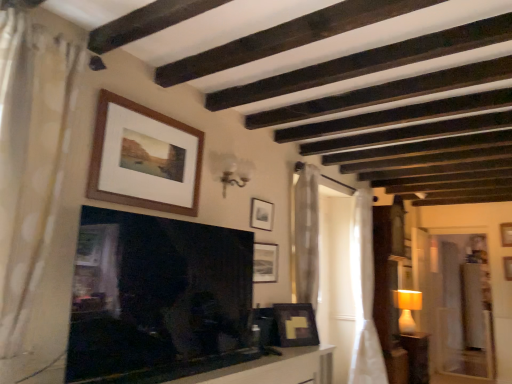
Question: Visually, is wooden frame at upper center, the 5th picture frame viewed from the back, positioned to the left or to the right of white sheer curtain at right, the 3th curtain positioned from the front?

Choices:
 (A) left
 (B) right

Answer: (A)

Question: Looking at the image, does wooden frame at upper center, marked as the first picture frame in a front-to-back arrangement, seem bigger or smaller compared to white sheer curtain at right, which ranks as the 1th curtain in right-to-left order?

Choices:
 (A) small
 (B) big

Answer: (A)

Question: Which is nearer to the wooden frame at upper center, positioned as the first picture frame in top-to-bottom order?

Choices:
 (A) matte black picture frame at lower right, which appears as the 3th picture frame when viewed from the front
 (B) wooden picture frame at upper center, the 2th picture frame in the bottom-to-top sequence
 (C) matte black picture frame at upper center, placed as the third picture frame when sorted from top to bottom
 (D) white dotted fabric curtain at left, the 3th curtain in the right-to-left sequence
 (E) white sheer curtain at right, which ranks as the 1th curtain in right-to-left order

Answer: (D)

Question: Estimate the real-world distances between objects in this image. Which object is closer to the white fabric lampshade at right?

Choices:
 (A) white sheer curtain at right, the 3th curtain positioned from the front
 (B) matte black picture frame at lower right, arranged as the fifth picture frame when viewed from the top
 (C) black glossy fireplace at center
 (D) wooden frame at upper center, the 5th picture frame viewed from the back
 (E) wooden picture frame at upper center, placed as the 5th picture frame when sorted from front to back

Answer: (A)